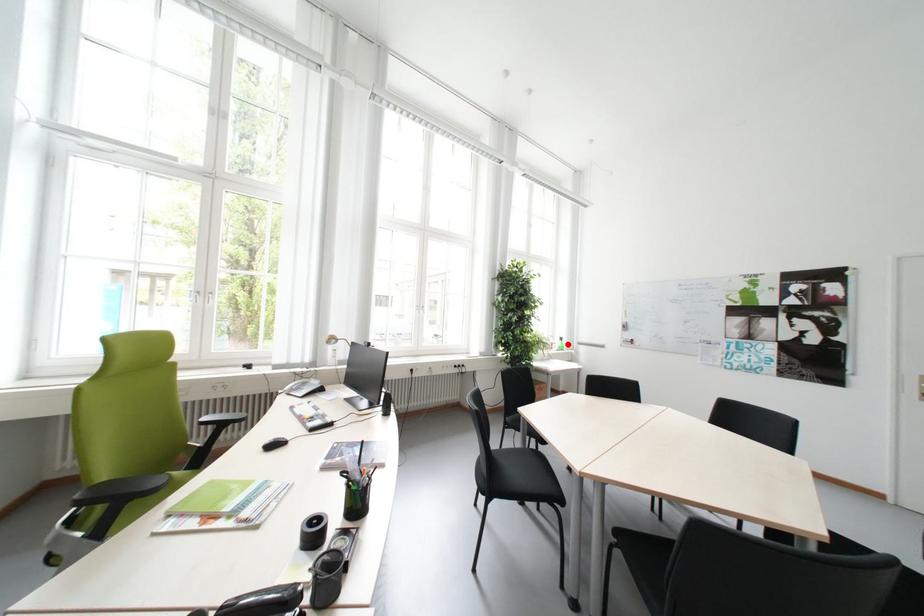
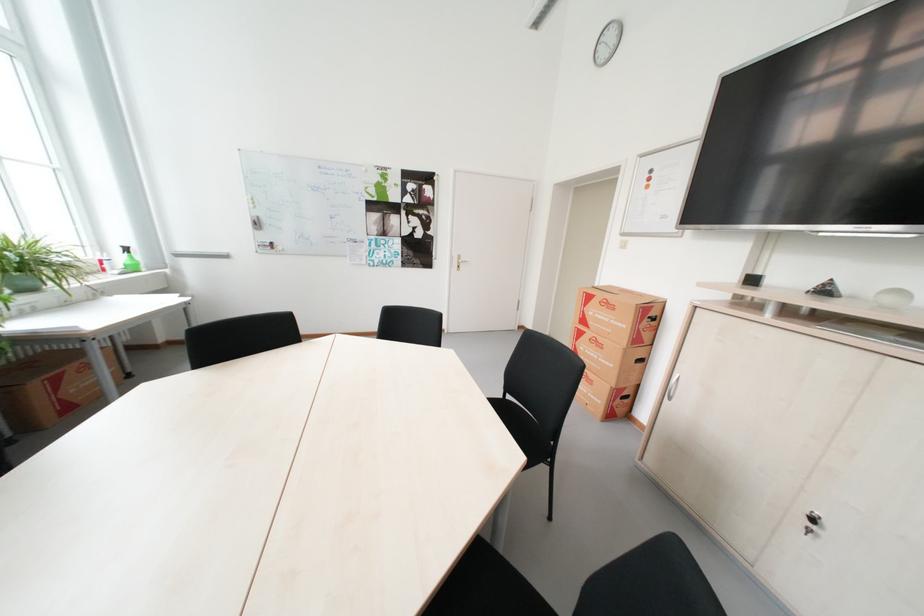
Question: I am providing you with two images of the same scene from different viewpoints. A red point is marked on the first image. Can you still see the location of the red point in image 2?

Choices:
 (A) Yes
 (B) No

Answer: (A)